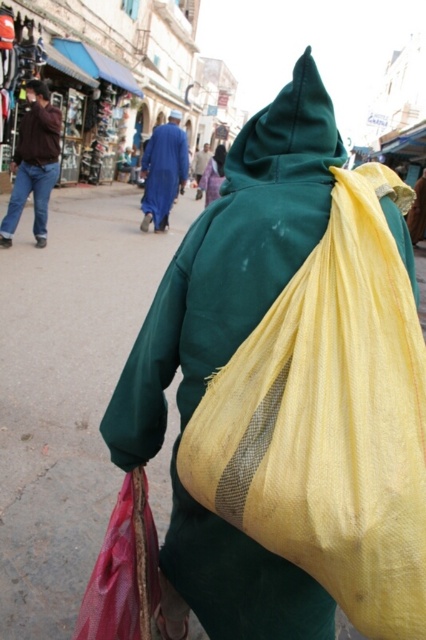
Is red mesh bag at lower left taller than blue cotton robe at center?

In fact, red mesh bag at lower left may be shorter than blue cotton robe at center.

Can you confirm if red mesh bag at lower left is shorter than blue cotton robe at center?

Yes.

Where is `red mesh bag at lower left`? The height and width of the screenshot is (640, 426). red mesh bag at lower left is located at coordinates (123, 570).

Can you confirm if matte brown jacket at left is taller than blue cotton robe at center?

In fact, matte brown jacket at left may be shorter than blue cotton robe at center.

This screenshot has height=640, width=426. What are the coordinates of `matte brown jacket at left` in the screenshot? It's located at (34, 163).

Image resolution: width=426 pixels, height=640 pixels. I want to click on matte brown jacket at left, so click(34, 163).

Who is lower down, red mesh bag at lower left or matte brown jacket at left?

red mesh bag at lower left is below.

Does red mesh bag at lower left appear on the right side of matte brown jacket at left?

Correct, you'll find red mesh bag at lower left to the right of matte brown jacket at left.

Who is more forward, (129, 497) or (23, 131)?

Positioned in front is point (129, 497).

Where is `red mesh bag at lower left`? red mesh bag at lower left is located at coordinates (123, 570).